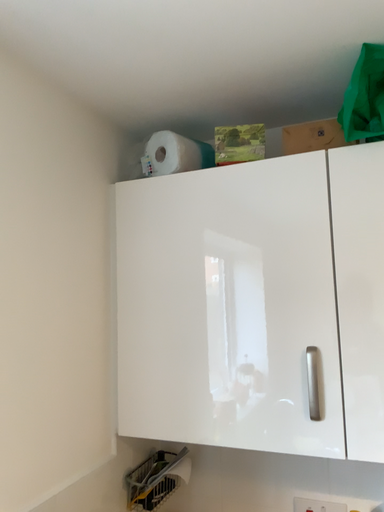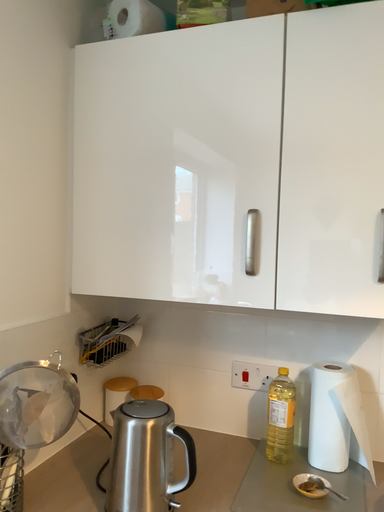
Question: How did the camera likely rotate when shooting the video?

Choices:
 (A) rotated upward
 (B) rotated downward

Answer: (B)